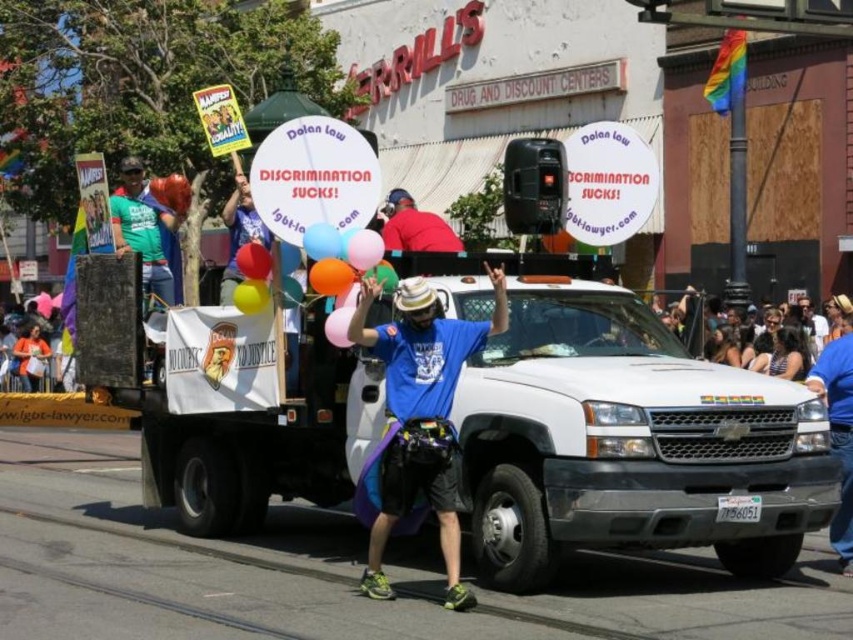
You are a photographer trying to capture the white matte truck at center and the pink matte balloon at center in a single frame. Considering their sizes, which object would appear larger in your photo?

The white matte truck at center is bigger than the pink matte balloon at center, so it would appear larger in the photo.

You are a photographer trying to capture a clear shot of both the translucent plastic balloon at center and the pink glossy balloon at center. Which balloon should you focus on first to ensure it appears larger in your photo?

The pink glossy balloon at center is taller than the translucent plastic balloon at center, so focusing on it first will ensure it appears larger in the photo.